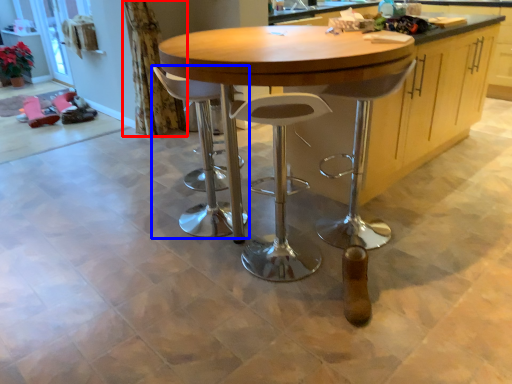
Question: Which of the following is the closest to the observer, curtain (highlighted by a red box) or stool (highlighted by a blue box)?

Choices:
 (A) curtain
 (B) stool

Answer: (B)